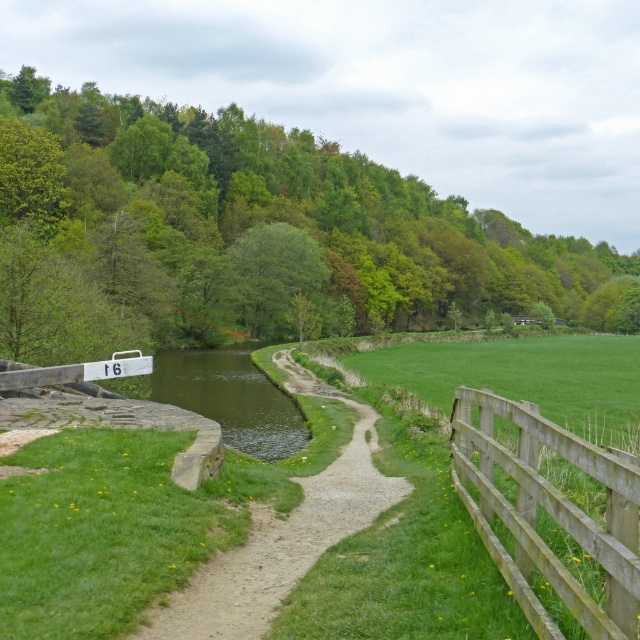
Question: Which of the following is the farthest from the observer?

Choices:
 (A) pyautogui.click(x=157, y=627)
 (B) pyautogui.click(x=134, y=148)

Answer: (B)

Question: Considering the relative positions of green leafy tree at upper center and wooden fence at right in the image provided, where is green leafy tree at upper center located with respect to wooden fence at right?

Choices:
 (A) right
 (B) left

Answer: (A)

Question: Which point is farther from the camera taking this photo?

Choices:
 (A) (486, 544)
 (B) (280, 528)

Answer: (B)

Question: Is green leafy tree at upper center below wooden fence at right?

Choices:
 (A) no
 (B) yes

Answer: (A)

Question: Which point is farther to the camera?

Choices:
 (A) (298, 552)
 (B) (129, 138)
 (C) (611, 496)

Answer: (B)

Question: In this image, where is green leafy tree at upper center located relative to wooden fence at right?

Choices:
 (A) right
 (B) left

Answer: (A)